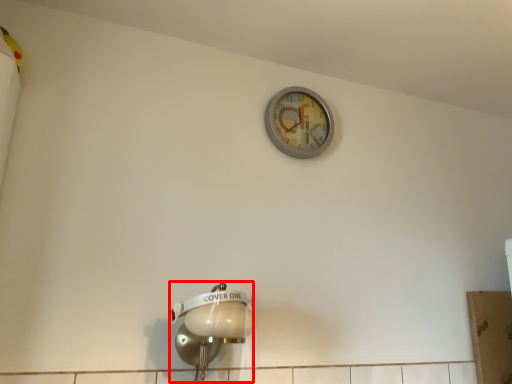
Question: From the image's perspective, where is light fixture (annotated by the red box) located in relation to wall clock in the image?

Choices:
 (A) above
 (B) below

Answer: (B)